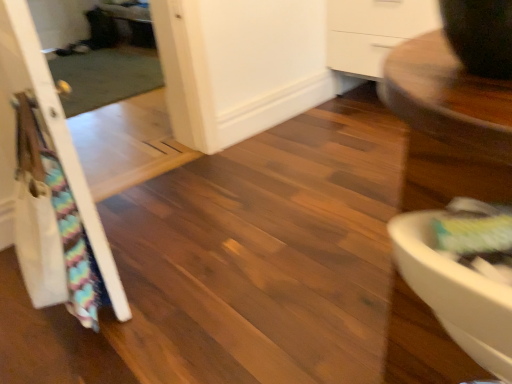
Where is `white matte screen door at center`? white matte screen door at center is located at coordinates (239, 66).

Describe the element at coordinates (239, 66) in the screenshot. The image size is (512, 384). I see `white matte screen door at center` at that location.

The height and width of the screenshot is (384, 512). What do you see at coordinates (47, 132) in the screenshot? I see `white wood door at left` at bounding box center [47, 132].

Where is `white wood door at left`? Image resolution: width=512 pixels, height=384 pixels. white wood door at left is located at coordinates (47, 132).

The width and height of the screenshot is (512, 384). Find the location of `white matte screen door at center`. white matte screen door at center is located at coordinates (239, 66).

Which object is positioned more to the right, white wood door at left or white matte screen door at center?

white matte screen door at center is more to the right.

Does white wood door at left lie behind white matte screen door at center?

No, white wood door at left is closer to the viewer.

Considering the positions of point (87, 210) and point (247, 62), is point (87, 210) closer or farther from the camera than point (247, 62)?

Clearly, point (87, 210) is closer to the camera than point (247, 62).

From the image's perspective, which one is positioned lower, white wood door at left or white matte screen door at center?

white wood door at left is shown below in the image.

From a real-world perspective, which object rests below the other?

white matte screen door at center.

Does white wood door at left have a greater width compared to white matte screen door at center?

No, white wood door at left is not wider than white matte screen door at center.

Who is shorter, white wood door at left or white matte screen door at center?

white matte screen door at center.

Considering the sizes of objects white wood door at left and white matte screen door at center in the image provided, who is smaller, white wood door at left or white matte screen door at center?

white wood door at left is smaller.

Is white matte screen door at center a part of white wood door at left?

No, white matte screen door at center is not surrounded by white wood door at left.

Is white wood door at left beside white matte screen door at center?

No, white wood door at left is not in contact with white matte screen door at center.

Is white matte screen door at center at the back of white wood door at left?

white wood door at left does not have its back to white matte screen door at center.

How different are the orientations of white wood door at left and white matte screen door at center in degrees?

white wood door at left and white matte screen door at center are facing 94.9 degrees away from each other.

Measure the distance from white wood door at left to white matte screen door at center.

The distance of white wood door at left from white matte screen door at center is 4.07 feet.

Where is `door below the white matte screen door at center (from the image's perspective)`? door below the white matte screen door at center (from the image's perspective) is located at coordinates (47, 132).

Can you confirm if white matte screen door at center is positioned to the left of white wood door at left?

In fact, white matte screen door at center is to the right of white wood door at left.

Consider the image. Between white matte screen door at center and white wood door at left, which one is positioned in front?

Positioned in front is white wood door at left.

Is point (226, 133) positioned in front of point (40, 288)?

No.

From the image's perspective, which is below, white matte screen door at center or white wood door at left?

white wood door at left is shown below in the image.

From a real-world perspective, is white matte screen door at center beneath white wood door at left?

Yes.

Does white matte screen door at center have a greater width compared to white wood door at left?

Correct, the width of white matte screen door at center exceeds that of white wood door at left.

Can you confirm if white matte screen door at center is taller than white wood door at left?

No, white matte screen door at center is not taller than white wood door at left.

In the scene shown: Can you confirm if white matte screen door at center is smaller than white wood door at left?

Incorrect, white matte screen door at center is not smaller in size than white wood door at left.

Could white wood door at left be considered to be inside white matte screen door at center?

Definitely not — white wood door at left is not inside white matte screen door at center.

Is white matte screen door at center far away from white wood door at left?

Yes.

Is white matte screen door at center facing away from white wood door at left?

white matte screen door at center does not have its back to white wood door at left.

Can you tell me how much white matte screen door at center and white wood door at left differ in facing direction?

The facing directions of white matte screen door at center and white wood door at left are 94.9 degrees apart.

Find the location of a particular element. This screenshot has width=512, height=384. door below the white matte screen door at center (from the image's perspective) is located at coordinates coord(47,132).

Where is `screen door that appears behind the white wood door at left`? This screenshot has height=384, width=512. screen door that appears behind the white wood door at left is located at coordinates (x=239, y=66).

The width and height of the screenshot is (512, 384). I want to click on door that is below the white matte screen door at center (from the image's perspective), so click(47, 132).